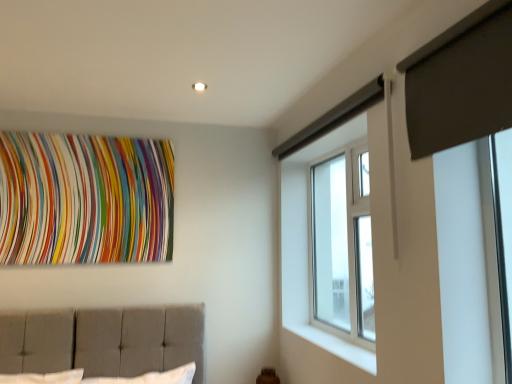
The width and height of the screenshot is (512, 384). Describe the element at coordinates (460, 82) in the screenshot. I see `dark gray fabric at upper right` at that location.

You are a GUI agent. You are given a task and a screenshot of the screen. Output one action in this format:
    pyautogui.click(x=<x>, y=<y>)
    Task: Click on the clear glass window at upper right
    Image resolution: width=512 pixels, height=384 pixels.
    Given the screenshot: What is the action you would take?
    pyautogui.click(x=342, y=246)

Is dark gray fabric at upper right next to white smooth window sill at lower right and touching it?

No, dark gray fabric at upper right is not in contact with white smooth window sill at lower right.

How distant is dark gray fabric at upper right from white smooth window sill at lower right?

1.26 meters.

From the image's perspective, is dark gray fabric at upper right above or below white smooth window sill at lower right?

dark gray fabric at upper right is situated higher than white smooth window sill at lower right in the image.

Which of these two, dark gray fabric at upper right or white smooth window sill at lower right, is wider?

Wider between the two is white smooth window sill at lower right.

Looking at this image, can you confirm if multicolored fabric at upper left is smaller than clear glass window at upper right?

Yes, multicolored fabric at upper left is smaller than clear glass window at upper right.

Considering the sizes of objects multicolored fabric at upper left and clear glass window at upper right in the image provided, who is taller, multicolored fabric at upper left or clear glass window at upper right?

clear glass window at upper right.

Locate an element on the screen. The image size is (512, 384). window lying on the right of multicolored fabric at upper left is located at coordinates (342, 246).

Considering the relative positions of multicolored fabric at upper left and clear glass window at upper right in the image provided, is multicolored fabric at upper left in front of clear glass window at upper right?

No, multicolored fabric at upper left is further to the viewer.

From a real-world perspective, who is located higher, dark gray fabric at upper right or clear glass window at upper right?

dark gray fabric at upper right is physically above.

From the image's perspective, relative to clear glass window at upper right, is dark gray fabric at upper right above or below?

Based on their image positions, dark gray fabric at upper right is located above clear glass window at upper right.

In the image, is dark gray fabric at upper right positioned in front of or behind clear glass window at upper right?

Visually, dark gray fabric at upper right is located in front of clear glass window at upper right.

Considering the relative sizes of dark gray fabric at upper right and clear glass window at upper right in the image provided, is dark gray fabric at upper right smaller than clear glass window at upper right?

Yes, dark gray fabric at upper right is smaller than clear glass window at upper right.

Considering the sizes of multicolored fabric at upper left and white smooth window sill at lower right in the image, is multicolored fabric at upper left wider or thinner than white smooth window sill at lower right?

Considering their sizes, multicolored fabric at upper left looks slimmer than white smooth window sill at lower right.

In terms of size, does multicolored fabric at upper left appear bigger or smaller than white smooth window sill at lower right?

Considering their sizes, multicolored fabric at upper left takes up more space than white smooth window sill at lower right.

From a real-world perspective, which is physically above, multicolored fabric at upper left or white smooth window sill at lower right?

From a 3D spatial view, multicolored fabric at upper left is above.

Which object is closer to the camera taking this photo, multicolored fabric at upper left or white smooth window sill at lower right?

Positioned in front is white smooth window sill at lower right.

Would you say clear glass window at upper right is to the left or to the right of white smooth window sill at lower right in the picture?

From the image, it's evident that clear glass window at upper right is to the right of white smooth window sill at lower right.

Which of these two, clear glass window at upper right or white smooth window sill at lower right, is wider?

white smooth window sill at lower right is wider.

Could you tell me if clear glass window at upper right is turned towards white smooth window sill at lower right?

Yes, clear glass window at upper right faces towards white smooth window sill at lower right.

Is clear glass window at upper right positioned in front of white smooth window sill at lower right?

No, it is not.

Measure the distance between white smooth window sill at lower right and clear glass window at upper right.

They are 21.78 inches apart.

Is white smooth window sill at lower right facing away from clear glass window at upper right?

Yes, white smooth window sill at lower right is facing away from clear glass window at upper right.

From the image's perspective, which object appears higher, white smooth window sill at lower right or clear glass window at upper right?

clear glass window at upper right.

Considering the points (312, 339) and (334, 156), which point is behind, point (312, 339) or point (334, 156)?

The point (334, 156) is more distant.

Considering the relative sizes of white smooth window sill at lower right and multicolored fabric at upper left in the image provided, is white smooth window sill at lower right wider than multicolored fabric at upper left?

Indeed, white smooth window sill at lower right has a greater width compared to multicolored fabric at upper left.

Which of these two, white smooth window sill at lower right or multicolored fabric at upper left, is bigger?

With larger size is multicolored fabric at upper left.

From the image's perspective, which one is positioned higher, white smooth window sill at lower right or multicolored fabric at upper left?

multicolored fabric at upper left is shown above in the image.

This screenshot has width=512, height=384. Find the location of `tapestry behind the white smooth window sill at lower right`. tapestry behind the white smooth window sill at lower right is located at coordinates (85, 199).

Where is `window sill on the left of the dark gray fabric at upper right`? This screenshot has height=384, width=512. window sill on the left of the dark gray fabric at upper right is located at coordinates (336, 346).

Where is `window that appears below the multicolored fabric at upper left (from a real-world perspective)`? The image size is (512, 384). window that appears below the multicolored fabric at upper left (from a real-world perspective) is located at coordinates click(342, 246).

Which object lies nearer to the anchor point clear glass window at upper right, multicolored fabric at upper left or dark gray fabric at upper right?

dark gray fabric at upper right is closer to clear glass window at upper right.

Estimate the real-world distances between objects in this image. Which object is further from white smooth window sill at lower right, dark gray fabric at upper right or multicolored fabric at upper left?

Based on the image, multicolored fabric at upper left appears to be further to white smooth window sill at lower right.

When comparing their distances from multicolored fabric at upper left, does clear glass window at upper right or white smooth window sill at lower right seem closer?

The object closer to multicolored fabric at upper left is clear glass window at upper right.

Estimate the real-world distances between objects in this image. Which object is further from white smooth window sill at lower right, clear glass window at upper right or multicolored fabric at upper left?

Among the two, multicolored fabric at upper left is located further to white smooth window sill at lower right.

Estimate the real-world distances between objects in this image. Which object is further from multicolored fabric at upper left, dark gray fabric at upper right or white smooth window sill at lower right?

dark gray fabric at upper right is positioned further to the anchor multicolored fabric at upper left.

Based on their spatial positions, is white smooth window sill at lower right or clear glass window at upper right further from dark gray fabric at upper right?

white smooth window sill at lower right is positioned further to the anchor dark gray fabric at upper right.

Based on their spatial positions, is white smooth window sill at lower right or dark gray fabric at upper right closer to multicolored fabric at upper left?

white smooth window sill at lower right.

Looking at the image, which one is located further to dark gray fabric at upper right, clear glass window at upper right or white smooth window sill at lower right?

The object further to dark gray fabric at upper right is white smooth window sill at lower right.

At what (x,y) coordinates should I click in order to perform the action: click on window sill between multicolored fabric at upper left and dark gray fabric at upper right from left to right. Please return your answer as a coordinate pair (x, y). Looking at the image, I should click on (336, 346).

The height and width of the screenshot is (384, 512). What are the coordinates of `window between multicolored fabric at upper left and dark gray fabric at upper right from left to right` in the screenshot? It's located at (342, 246).

Find the location of a particular element. This screenshot has width=512, height=384. window that lies between dark gray fabric at upper right and white smooth window sill at lower right from top to bottom is located at coordinates (342, 246).

Find the location of a particular element. The image size is (512, 384). window sill between multicolored fabric at upper left and clear glass window at upper right from left to right is located at coordinates (336, 346).